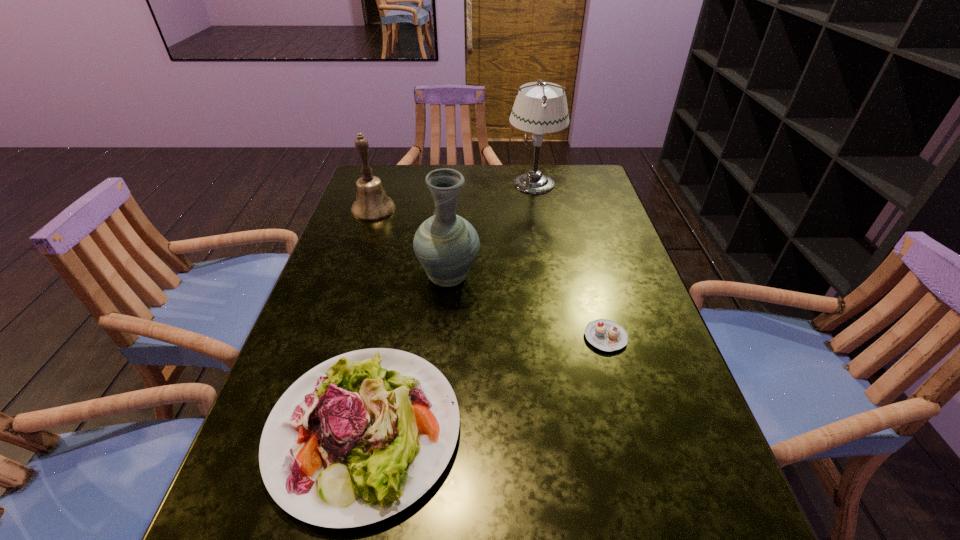
At what (x,y) coordinates should I click in order to perform the action: click on salad plate located in the left edge section of the desktop. Please return your answer as a coordinate pair (x, y). This screenshot has height=540, width=960. Looking at the image, I should click on (358, 438).

Identify the location of lampshade that is at the right edge. (543, 109).

The width and height of the screenshot is (960, 540). I want to click on cupcake that is at the right edge, so [604, 334].

The height and width of the screenshot is (540, 960). In order to click on object that is at the far left corner in this screenshot , I will do `click(372, 204)`.

Where is `object positioned at the far right corner`? The width and height of the screenshot is (960, 540). object positioned at the far right corner is located at coordinates (543, 109).

You are a GUI agent. You are given a task and a screenshot of the screen. Output one action in this format:
    pyautogui.click(x=<x>, y=<y>)
    Task: Click on the free space at the far edge
    
    Given the screenshot: What is the action you would take?
    pyautogui.click(x=458, y=198)

In the image, there is a desktop. Where is `vacant region at the left edge`? The width and height of the screenshot is (960, 540). vacant region at the left edge is located at coordinates (371, 227).

Where is `free location at the right edge of the desktop`? The height and width of the screenshot is (540, 960). free location at the right edge of the desktop is located at coordinates (604, 274).

The height and width of the screenshot is (540, 960). Identify the location of free point at the far left corner. (382, 174).

This screenshot has height=540, width=960. In the image, there is a desktop. In order to click on vacant space at the far right corner in this screenshot , I will do `click(579, 171)`.